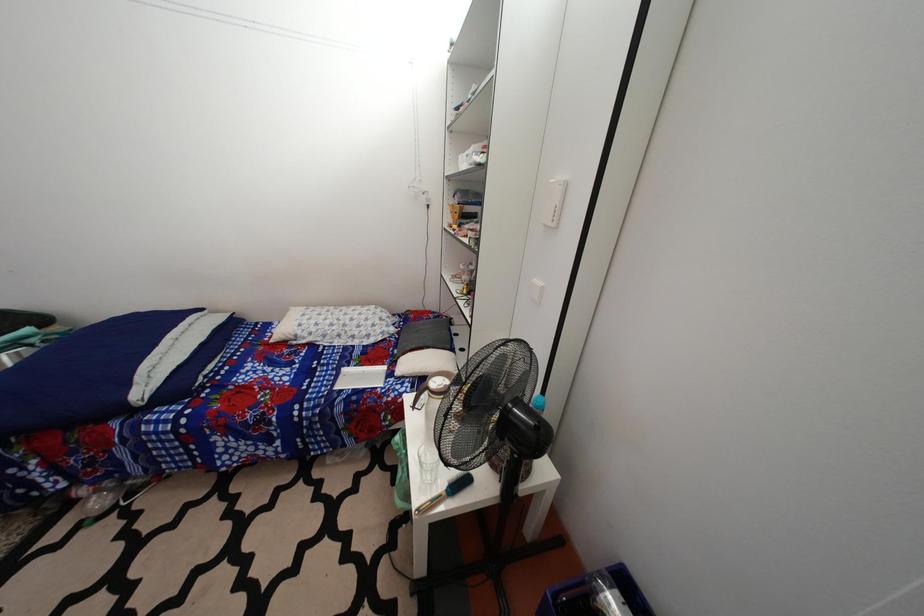
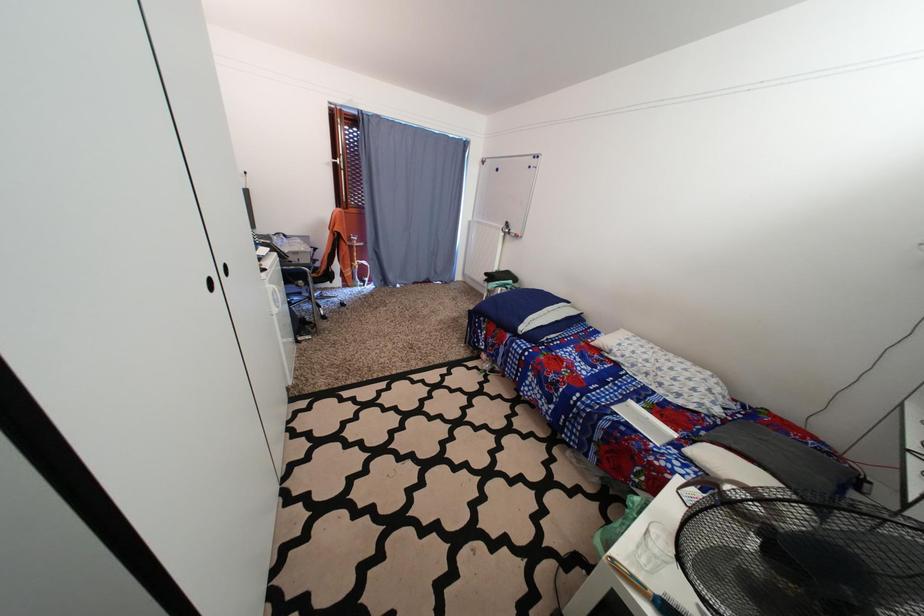
Question: The images are taken continuously from a first-person perspective. In which direction is your viewpoint rotating?

Choices:
 (A) Left
 (B) Right
 (C) Up
 (D) Down

Answer: (A)